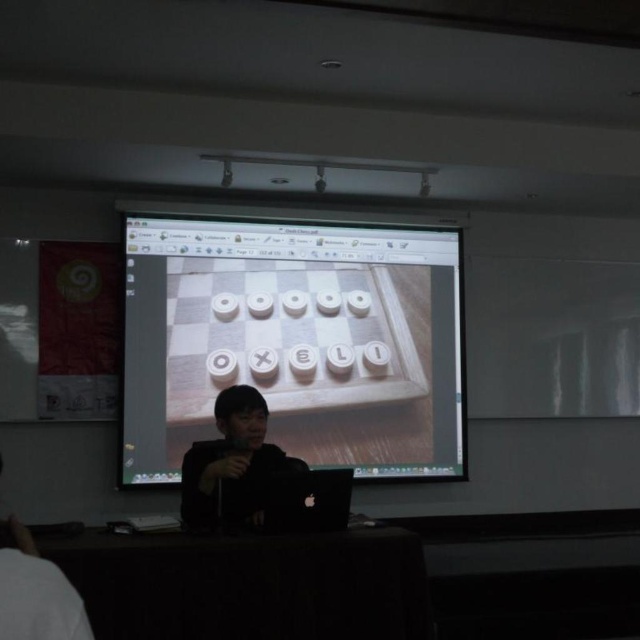
You are a presenter standing at the podium. You need to adjust the position of the wooden board at center so that it is exactly 1.2 meters away from your black matte shirt at center. Based on the current distance, should you move the wooden board closer or farther away?

The wooden board at center is currently 1.31 meters away from the black matte shirt at center. To achieve the desired distance of 1.2 meters, you should move the wooden board closer to the black matte shirt at center by 0.11 meters.

You are a photographer adjusting the camera focus. The wooden board at center and the black matte shirt at center are both in the frame. Which object should you focus on first if you want to ensure the larger object is sharp?

The wooden board at center is bigger than the black matte shirt at center, so you should focus on the wooden board at center first to ensure it is sharp.

Looking at this image, you are an attendee at the presentation and want to know if the wooden board at center is wider than the black matte shirt at center. Can you determine this based on the visual information provided?

The wooden board at center is wider than the black matte shirt at center because the wooden board at center has a greater width as stated in the description.